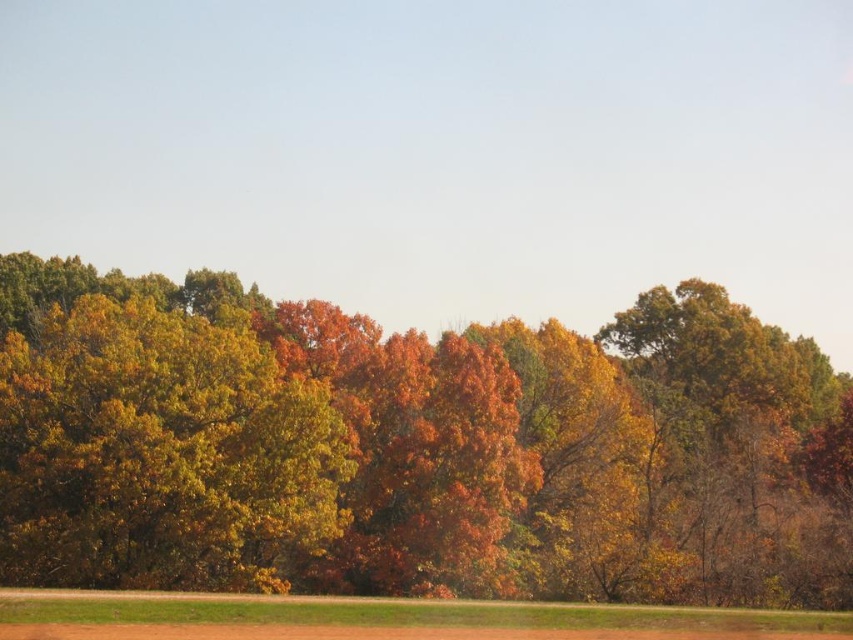
You are planning to take a photo of the autumn foliage at center and golden textured leaves at left. Which one should you focus on if you want to capture the wider area in your shot?

The autumn foliage at center has a greater width compared to the golden textured leaves at left, so focusing on the autumn foliage at center will allow you to capture a wider area in your shot.

You are a photographer aiming to capture the golden textured leaves at left and autumn foliage at center in a single shot. Which object should you focus on first to ensure both are in sharp focus?

You should focus on the autumn foliage at center first because the golden textured leaves at left is behind autumn foliage at center, so focusing on the closer object ensures both are in focus.